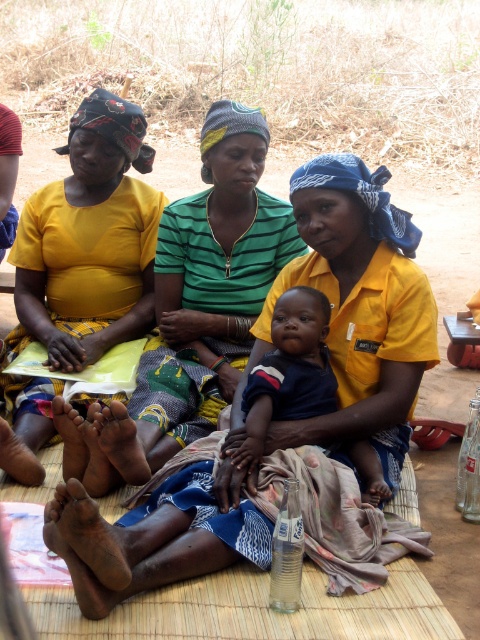
You are a photographer standing in front of the three women. You notice the yellow fabric at upper left and the dark blue cotton shirt at center. Which object is closer to you?

The yellow fabric at upper left is closer to you because it is further to the viewer than the dark blue cotton shirt at center.